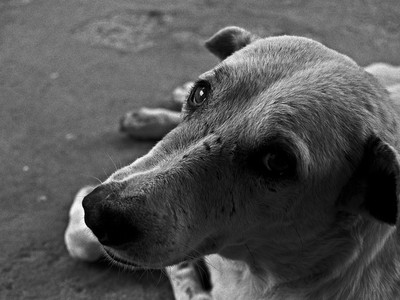
Where is `gray floor`? gray floor is located at coordinates (71, 108).